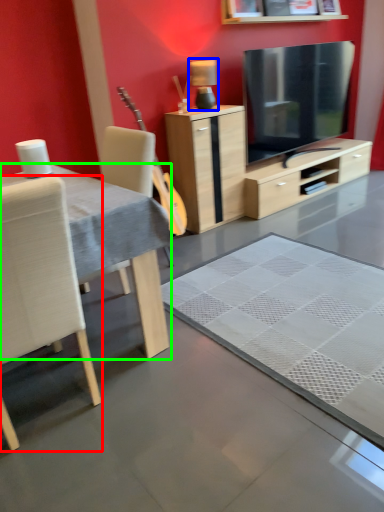
Question: Which object is positioned closest to chair (highlighted by a red box)? Select from lamp (highlighted by a blue box) and desk (highlighted by a green box).

Choices:
 (A) lamp
 (B) desk

Answer: (B)